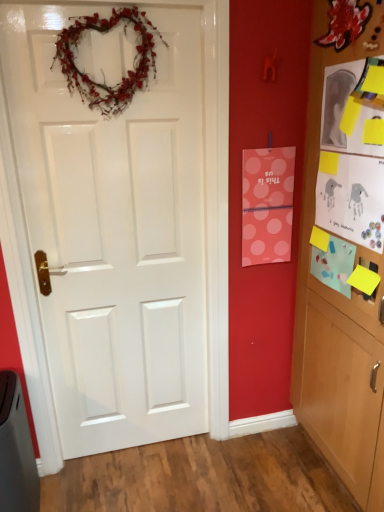
Question: From a real-world perspective, does white glossy door at center sit lower than natural twig heart wreath at upper center?

Choices:
 (A) yes
 (B) no

Answer: (A)

Question: Is white glossy door at center closer to camera compared to natural twig heart wreath at upper center?

Choices:
 (A) no
 (B) yes

Answer: (B)

Question: Does white glossy door at center lie behind natural twig heart wreath at upper center?

Choices:
 (A) no
 (B) yes

Answer: (A)

Question: Is white glossy door at center facing towards natural twig heart wreath at upper center?

Choices:
 (A) yes
 (B) no

Answer: (A)

Question: Does white glossy door at center have a larger size compared to natural twig heart wreath at upper center?

Choices:
 (A) no
 (B) yes

Answer: (B)

Question: Is white glossy door at center shorter than natural twig heart wreath at upper center?

Choices:
 (A) yes
 (B) no

Answer: (B)

Question: Considering the relative sizes of matte blue paper at right, which is counted as the second postcard, starting from the right, and pink polka dot paper at upper right, placed as the 3th postcard when sorted from right to left, in the image provided, is matte blue paper at right, which is counted as the second postcard, starting from the right, taller than pink polka dot paper at upper right, placed as the 3th postcard when sorted from right to left,?

Choices:
 (A) yes
 (B) no

Answer: (B)

Question: From a real-world perspective, is matte blue paper at right, which ranks as the second postcard in left-to-right order, located higher than pink polka dot paper at upper right, placed as the 3th postcard when sorted from right to left?

Choices:
 (A) yes
 (B) no

Answer: (B)

Question: From a real-world perspective, is matte blue paper at right, which is counted as the second postcard, starting from the right, under pink polka dot paper at upper right, the 1th postcard from the left?

Choices:
 (A) yes
 (B) no

Answer: (A)

Question: Does matte blue paper at right, which ranks as the second postcard in left-to-right order, have a greater width compared to pink polka dot paper at upper right, placed as the 3th postcard when sorted from right to left?

Choices:
 (A) yes
 (B) no

Answer: (B)

Question: Is matte blue paper at right, which ranks as the second postcard in left-to-right order, not near pink polka dot paper at upper right, the 1th postcard from the left?

Choices:
 (A) yes
 (B) no

Answer: (B)

Question: Considering the relative sizes of matte blue paper at right, which is counted as the second postcard, starting from the right, and pink polka dot paper at upper right, placed as the 3th postcard when sorted from right to left, in the image provided, is matte blue paper at right, which is counted as the second postcard, starting from the right, smaller than pink polka dot paper at upper right, placed as the 3th postcard when sorted from right to left,?

Choices:
 (A) yes
 (B) no

Answer: (A)

Question: Does wooden cabinet at right have a lesser width compared to white glossy door at center?

Choices:
 (A) no
 (B) yes

Answer: (A)